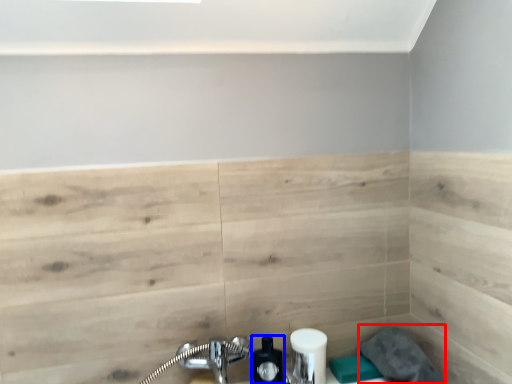
Question: Which object is further to the camera taking this photo, gray (highlighted by a red box) or soap dispenser (highlighted by a blue box)?

Choices:
 (A) gray
 (B) soap dispenser

Answer: (B)